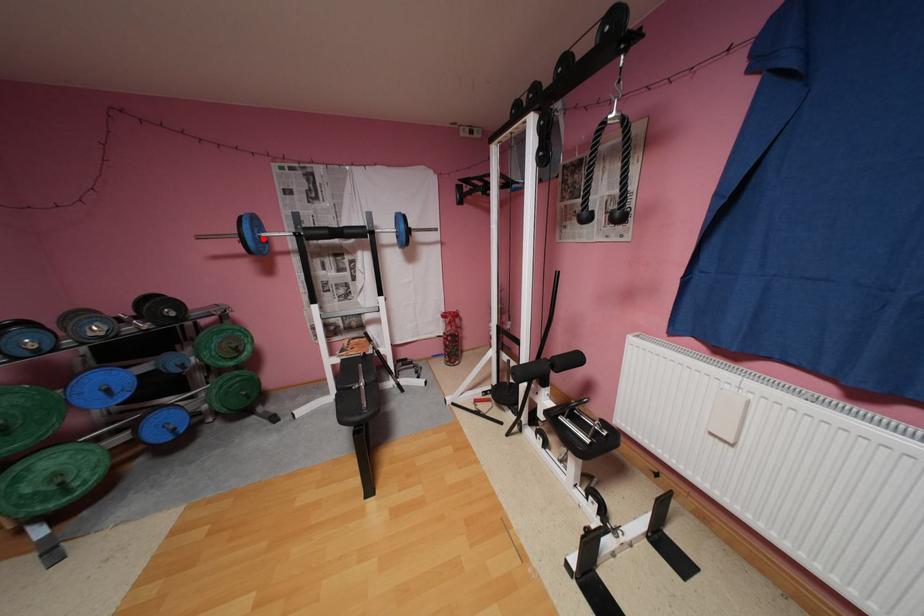
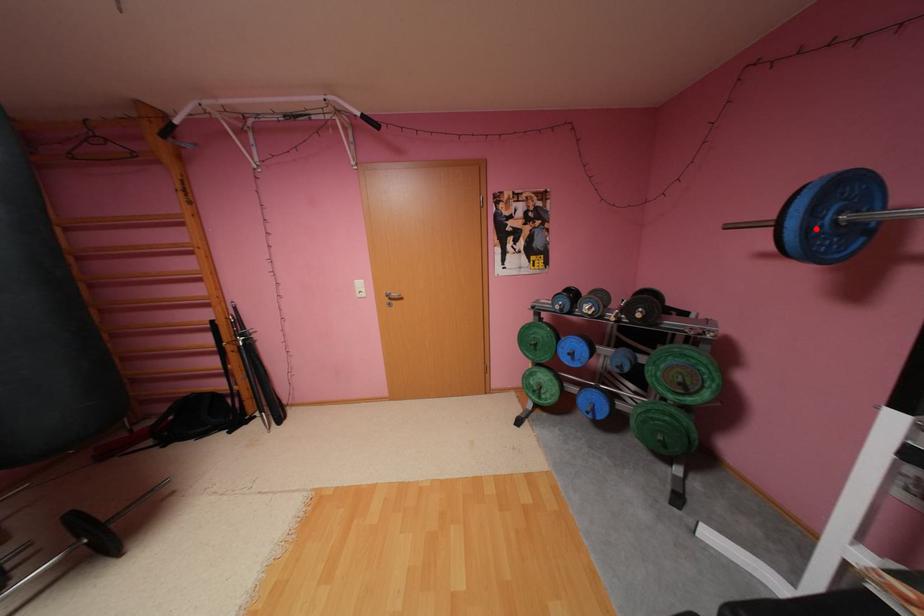
I am providing you with two images of the same scene from different viewpoints. A red point is marked on the first image and another point is marked on the second image. Are the points marked in image1 and image2 representing the same 3D position?

Yes